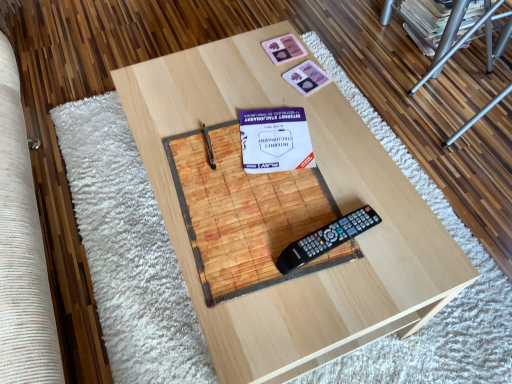
Question: Looking at the image, does wooden table at center seem bigger or smaller compared to matte cardboard magazine at upper right?

Choices:
 (A) small
 (B) big

Answer: (B)

Question: Is wooden table at center to the left or to the right of matte cardboard magazine at upper right in the image?

Choices:
 (A) left
 (B) right

Answer: (A)

Question: Which of these objects is positioned farthest from the matte cardboard magazine at upper right?

Choices:
 (A) white paper at center
 (B) black plastic remote control at center
 (C) wooden table at center
 (D) pink matte playing card at upper center, which ranks as the 2th square in top-to-bottom order
 (E) pink matte coaster at upper center, arranged as the 1th square when viewed from the top

Answer: (B)

Question: Estimate the real-world distances between objects in this image. Which object is closer to the wooden table at center?

Choices:
 (A) metallic silver ladder at upper right
 (B) pink matte coaster at upper center, arranged as the 1th square when viewed from the top
 (C) pink matte playing card at upper center, which ranks as the 2th square in top-to-bottom order
 (D) black plastic remote control at center
 (E) white paper at center

Answer: (E)